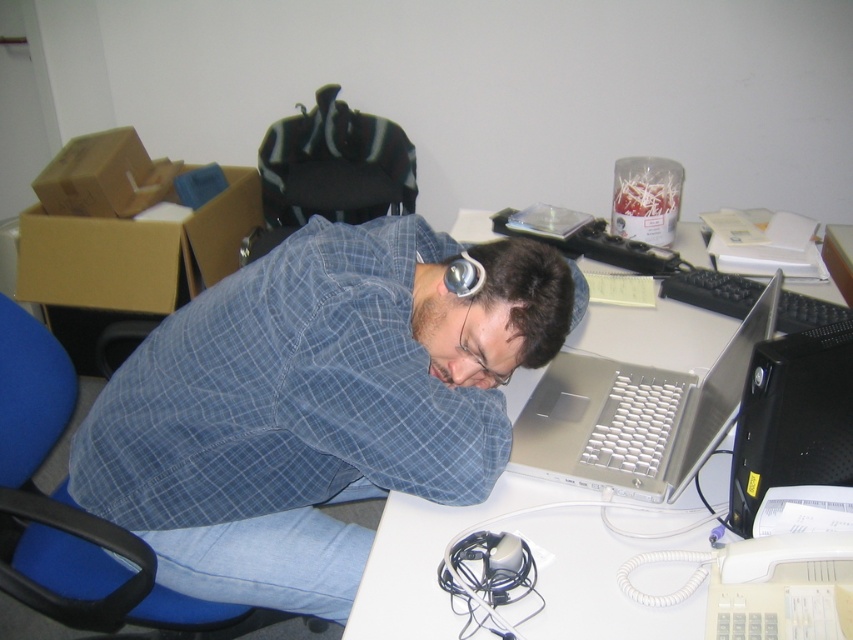
Who is shorter, blue plaid shirt at center or silver metallic laptop at center?

silver metallic laptop at center is shorter.

Is blue plaid shirt at center wider than silver metallic laptop at center?

Yes, blue plaid shirt at center is wider than silver metallic laptop at center.

Which is in front, point (201, 376) or point (598, 387)?

Point (201, 376) is in front.

The width and height of the screenshot is (853, 640). I want to click on blue plaid shirt at center, so (x=316, y=404).

Does silver metallic laptop at center come behind black plastic desktop computer at right?

Yes, it is.

This screenshot has width=853, height=640. I want to click on silver metallic laptop at center, so click(635, 416).

Is point (550, 380) closer to viewer compared to point (769, 422)?

No, (550, 380) is behind (769, 422).

The width and height of the screenshot is (853, 640). In order to click on silver metallic laptop at center in this screenshot , I will do `click(635, 416)`.

Can you confirm if white plastic computer desk at center is thinner than silver metallic laptop at center?

In fact, white plastic computer desk at center might be wider than silver metallic laptop at center.

Is white plastic computer desk at center wider than silver metallic laptop at center?

Correct, the width of white plastic computer desk at center exceeds that of silver metallic laptop at center.

Is point (654, 577) farther from camera compared to point (677, 465)?

No, (654, 577) is in front of (677, 465).

I want to click on white plastic computer desk at center, so click(x=428, y=560).